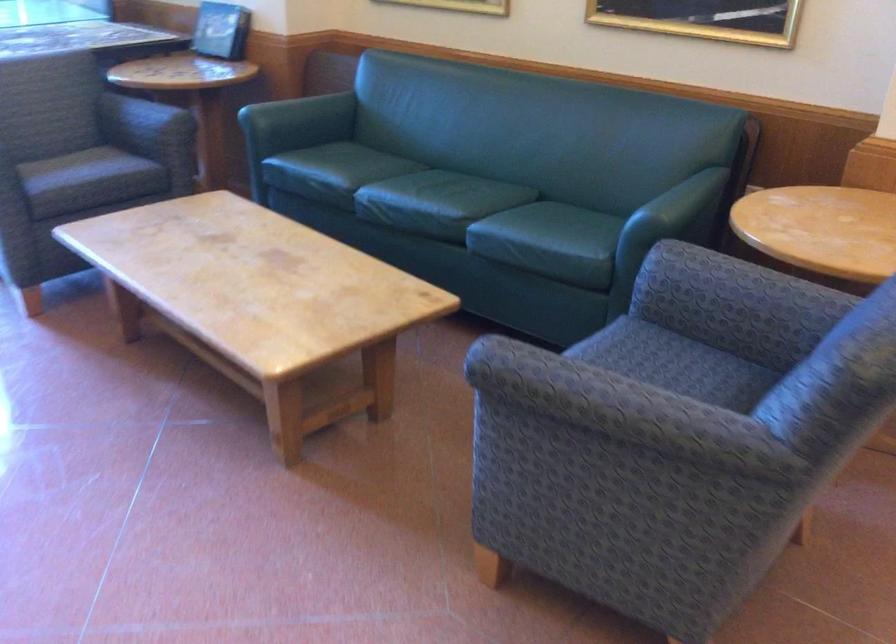
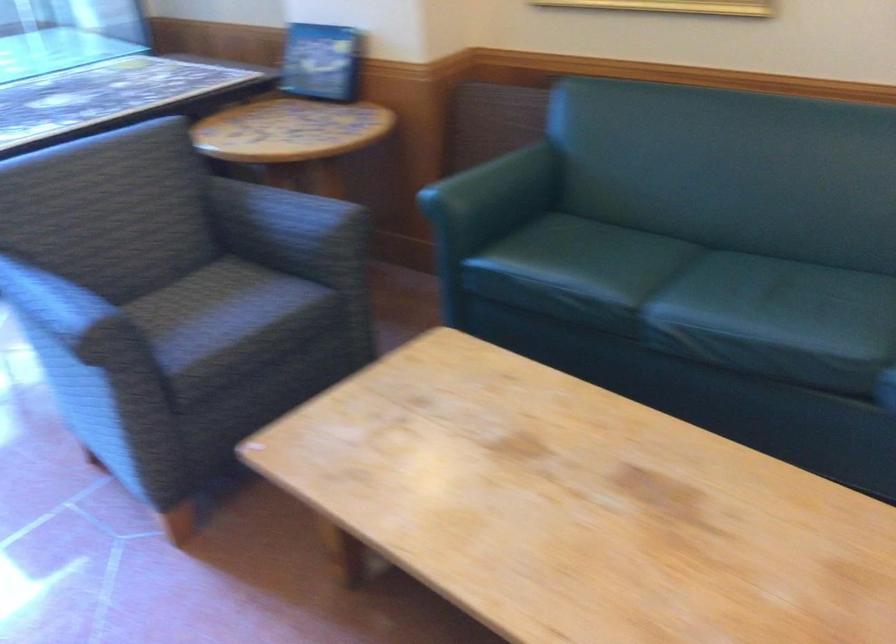
Find the pixel in the second image that matches point (81, 166) in the first image.

(224, 317)